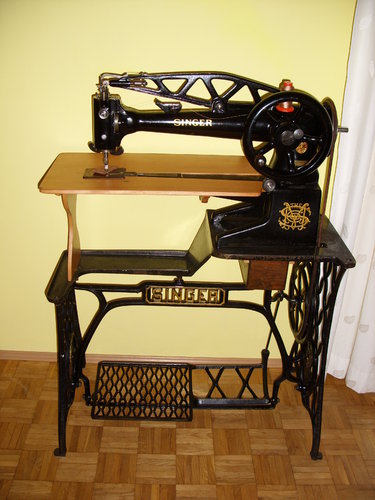
Identify the location of wood box. This screenshot has height=500, width=375. (264, 278).